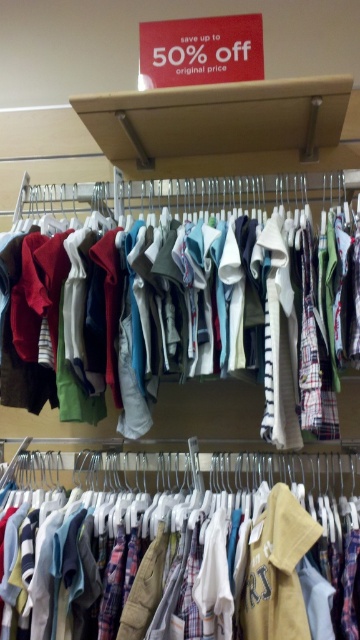
You are a customer looking at the plaid fabric shirts at center and the matte cotton shorts at center in the clothing store. Which item is closer to you?

The plaid fabric shirts at center is in front of the matte cotton shorts at center, so the plaid fabric shirts at center is closer to you.

You are a customer looking at the plaid fabric shirts at center and the matte cotton shorts at center in the clothing store. Which item is located to the left of the other?

The plaid fabric shirts at center is positioned on the left side of matte cotton shorts at center.